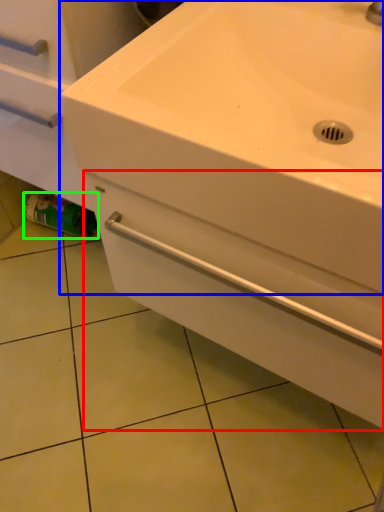
Question: Which is farther away from drawer (highlighted by a red box)? sink (highlighted by a blue box) or toilet paper (highlighted by a green box)?

Choices:
 (A) sink
 (B) toilet paper

Answer: (B)